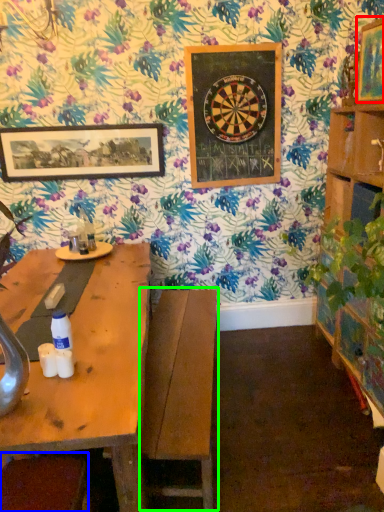
Question: Estimate the real-world distances between objects in this image. Which object is farther from picture frame (highlighted by a red box), swivel chair (highlighted by a blue box) or swivel chair (highlighted by a green box)?

Choices:
 (A) swivel chair
 (B) swivel chair

Answer: (A)